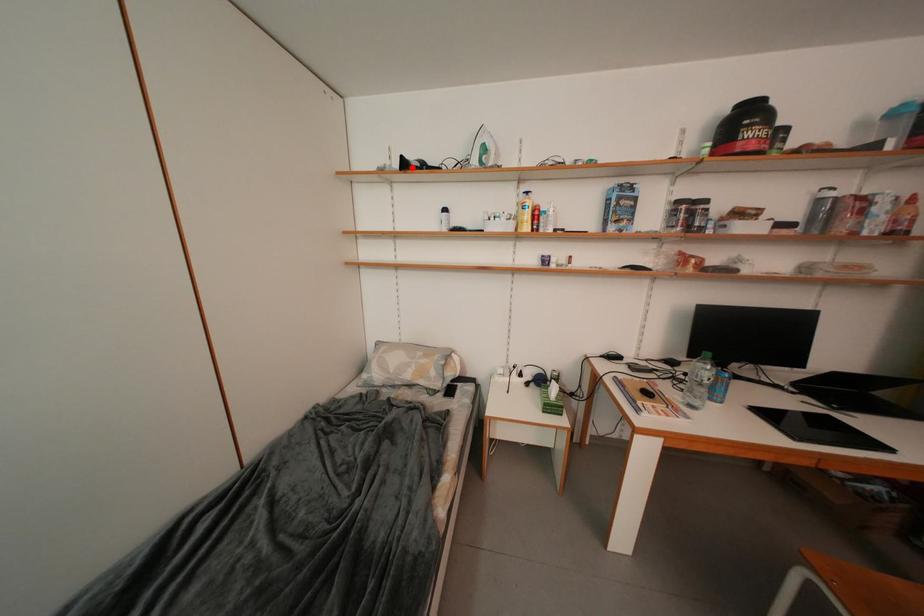
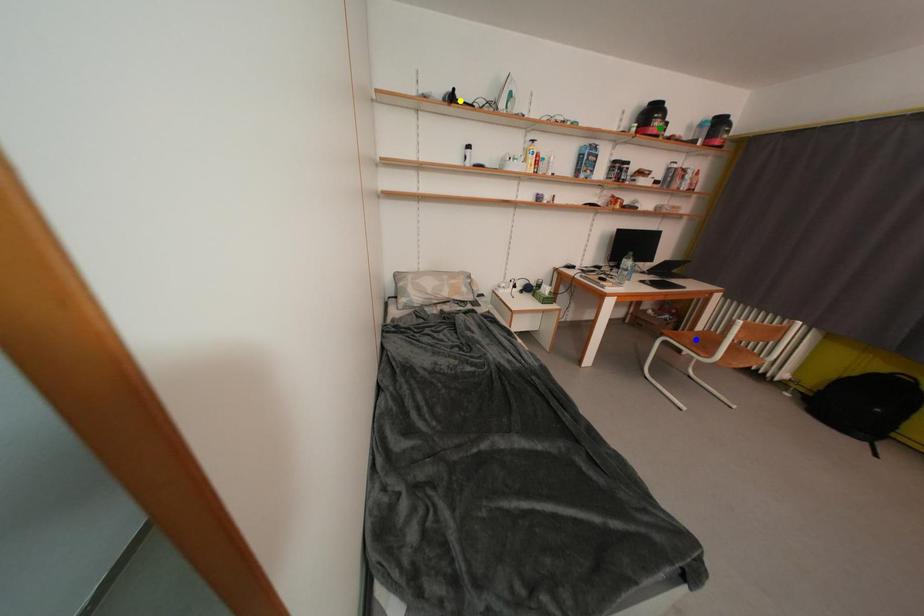
Question: I am providing you with two images of the same scene from different viewpoints. A red point is marked on the first image. You are given multiple points on the second image. In image 2, which mark is for the same physical point as the one in image 1?

Choices:
 (A) yellow point
 (B) green point
 (C) blue point

Answer: (A)